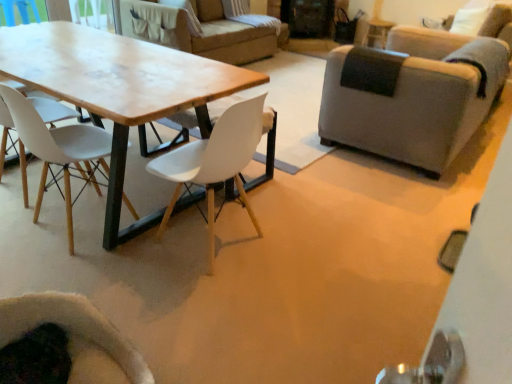
Question: Is gray fabric armchair at right, which is counted as the first chair, starting from the right, positioned behind velvet dark green armchair at lower left, which is the 2th chair in left-to-right order?

Choices:
 (A) yes
 (B) no

Answer: (A)

Question: Is velvet dark green armchair at lower left, which is the 2th chair in left-to-right order, a part of gray fabric armchair at right, which is counted as the first chair, starting from the right?

Choices:
 (A) no
 (B) yes

Answer: (A)

Question: Can you confirm if gray fabric armchair at right, which is counted as the first chair, starting from the right, is shorter than velvet dark green armchair at lower left, which is the 2th chair in left-to-right order?

Choices:
 (A) no
 (B) yes

Answer: (A)

Question: From a real-world perspective, is gray fabric armchair at right, which is counted as the first chair, starting from the right, over velvet dark green armchair at lower left, which is the 2th chair in left-to-right order?

Choices:
 (A) yes
 (B) no

Answer: (A)

Question: From the image's perspective, is gray fabric armchair at right, which is counted as the first chair, starting from the right, below velvet dark green armchair at lower left, which is the 2th chair in left-to-right order?

Choices:
 (A) no
 (B) yes

Answer: (A)

Question: Does gray fabric armchair at right, which is counted as the first chair, starting from the right, appear on the right side of velvet dark green armchair at lower left, which is the 2th chair in left-to-right order?

Choices:
 (A) no
 (B) yes

Answer: (B)

Question: Considering the relative sizes of white matte chair at center, positioned as the 3th chair in left-to-right order, and wooden table at center in the image provided, is white matte chair at center, positioned as the 3th chair in left-to-right order, wider than wooden table at center?

Choices:
 (A) yes
 (B) no

Answer: (B)

Question: Is the depth of white matte chair at center, the 2th chair in the right-to-left sequence, less than that of wooden table at center?

Choices:
 (A) no
 (B) yes

Answer: (B)

Question: Are white matte chair at center, the 2th chair in the right-to-left sequence, and wooden table at center located far from each other?

Choices:
 (A) yes
 (B) no

Answer: (B)

Question: Can you confirm if white matte chair at center, the 2th chair in the right-to-left sequence, is smaller than wooden table at center?

Choices:
 (A) no
 (B) yes

Answer: (B)

Question: Is white matte chair at center, the 2th chair in the right-to-left sequence, facing away from wooden table at center?

Choices:
 (A) yes
 (B) no

Answer: (B)

Question: Considering the relative sizes of white matte chair at center, the 2th chair in the right-to-left sequence, and wooden table at center in the image provided, is white matte chair at center, the 2th chair in the right-to-left sequence, shorter than wooden table at center?

Choices:
 (A) no
 (B) yes

Answer: (A)

Question: Can we say white matte chair at center, positioned as the 3th chair in left-to-right order, lies outside velvet dark green armchair at lower left, which is the third chair from right to left?

Choices:
 (A) no
 (B) yes

Answer: (B)